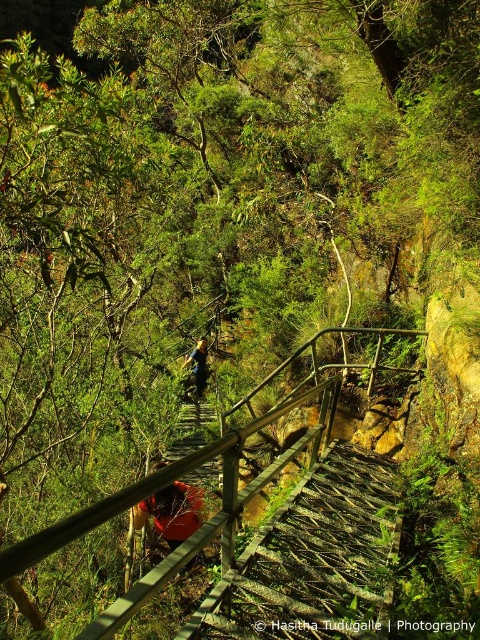
Does wooden staircase at center have a lesser height compared to green fabric backpack at center?

Yes, wooden staircase at center is shorter than green fabric backpack at center.

The height and width of the screenshot is (640, 480). Describe the element at coordinates (312, 557) in the screenshot. I see `wooden staircase at center` at that location.

This screenshot has height=640, width=480. Identify the location of wooden staircase at center. (312, 557).

Identify the location of wooden staircase at center. (312, 557).

Does wooden staircase at center have a greater height compared to metal/wooden rail at center?

Yes.

Who is positioned more to the right, wooden staircase at center or metal/wooden rail at center?

From the viewer's perspective, metal/wooden rail at center appears more on the right side.

Is point (266, 540) positioned behind point (120, 611)?

Yes, point (266, 540) is farther from viewer.

At what (x,y) coordinates should I click in order to perform the action: click on wooden staircase at center. Please return your answer as a coordinate pair (x, y). Looking at the image, I should click on (312, 557).

Measure the distance between metal/wooden rail at center and camera.

23.75 feet

Which of these two, metal/wooden rail at center or green fabric backpack at center, stands shorter?

Answer: Standing shorter between the two is metal/wooden rail at center.

This screenshot has height=640, width=480. Find the location of `metal/wooden rail at center`. metal/wooden rail at center is located at coordinates (163, 486).

Where is `metal/wooden rail at center`? metal/wooden rail at center is located at coordinates (163, 486).